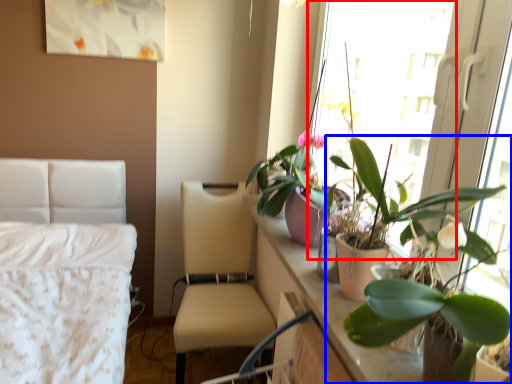
Question: Which of the following is the closest to the observer, window screen (highlighted by a red box) or houseplant (highlighted by a blue box)?

Choices:
 (A) window screen
 (B) houseplant

Answer: (B)